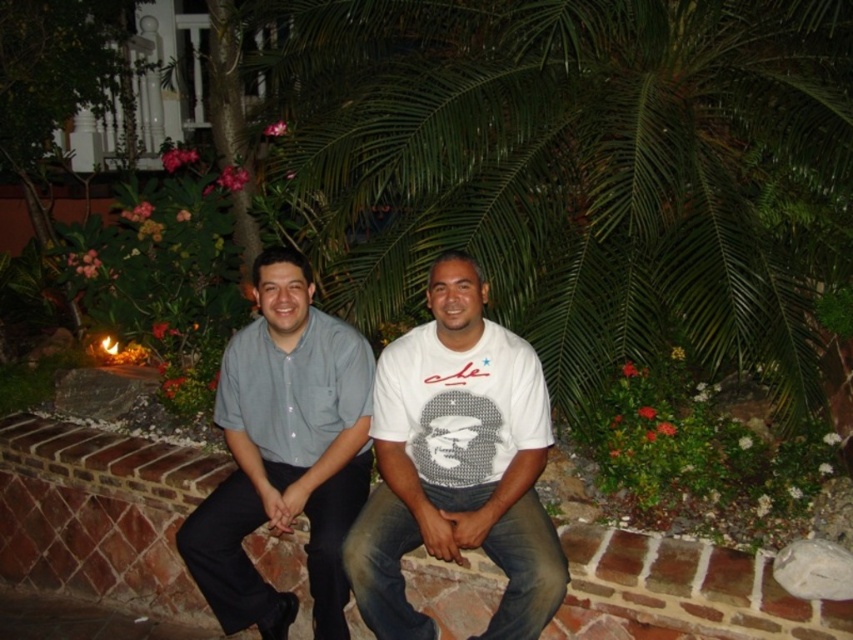
Question: Which point appears farthest from the camera in this image?

Choices:
 (A) (718, 266)
 (B) (469, 518)

Answer: (A)

Question: Is green leafy palm tree at center to the right of white matte t-shirt at center from the viewer's perspective?

Choices:
 (A) no
 (B) yes

Answer: (B)

Question: Is green leafy palm tree at center to the right of light blue cotton shirt at center from the viewer's perspective?

Choices:
 (A) yes
 (B) no

Answer: (A)

Question: Based on their relative distances, which object is nearer to the light blue cotton shirt at center?

Choices:
 (A) white matte t-shirt at center
 (B) green leafy palm tree at center

Answer: (A)

Question: Which of the following is the farthest from the observer?

Choices:
 (A) (508, 424)
 (B) (207, 506)
 (C) (645, 301)

Answer: (C)

Question: Does green leafy palm tree at center appear on the right side of white matte t-shirt at center?

Choices:
 (A) no
 (B) yes

Answer: (B)